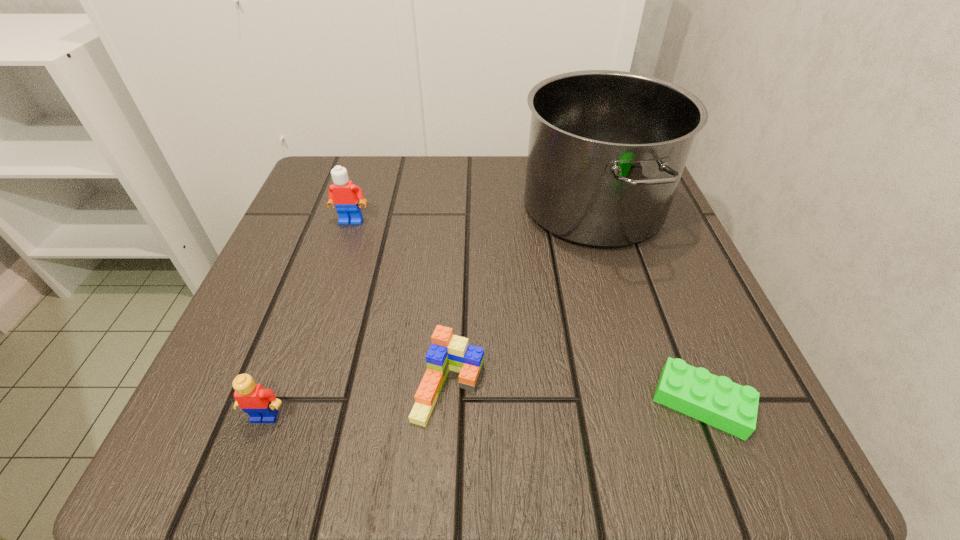
Locate an element on the screen. saucepan is located at coordinates (607, 149).

The image size is (960, 540). I want to click on the farthest Lego, so click(343, 194).

Find the location of a particular element. This screenshot has width=960, height=540. the tallest Lego is located at coordinates (343, 194).

Find the location of `the third shortest object`. the third shortest object is located at coordinates (260, 404).

Find the location of a particular element. This screenshot has height=540, width=960. the third tallest Lego is located at coordinates (447, 352).

Find the location of a particular element. the fourth tallest object is located at coordinates (447, 352).

At what (x,y) coordinates should I click in order to perform the action: click on the shortest object. Please return your answer as a coordinate pair (x, y). The image size is (960, 540). Looking at the image, I should click on (717, 401).

Locate an element on the screen. the rightmost Lego is located at coordinates (717, 401).

Image resolution: width=960 pixels, height=540 pixels. I want to click on vacant area situated on the front of the saucepan, so click(627, 318).

You are a GUI agent. You are given a task and a screenshot of the screen. Output one action in this format:
    pyautogui.click(x=<x>, y=<y>)
    Task: Click on the free location located on the face of the tallest Lego
    Image resolution: width=960 pixels, height=540 pixels.
    Given the screenshot: What is the action you would take?
    pyautogui.click(x=316, y=327)